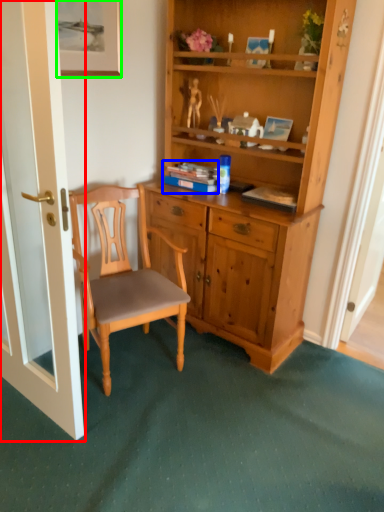
Question: Which object is positioned closest to door (highlighted by a red box)? Select from book (highlighted by a blue box) and picture frame (highlighted by a green box).

Choices:
 (A) book
 (B) picture frame

Answer: (B)